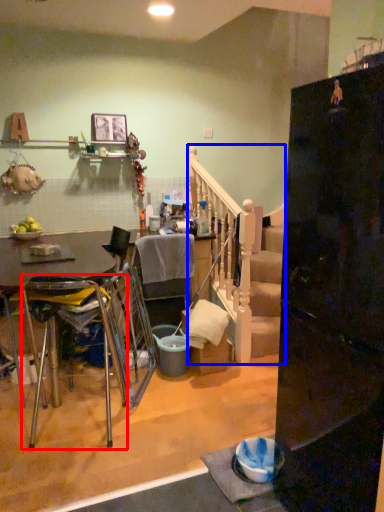
Question: Among these objects, which one is farthest to the camera, chair (highlighted by a red box) or rail (highlighted by a blue box)?

Choices:
 (A) chair
 (B) rail

Answer: (B)